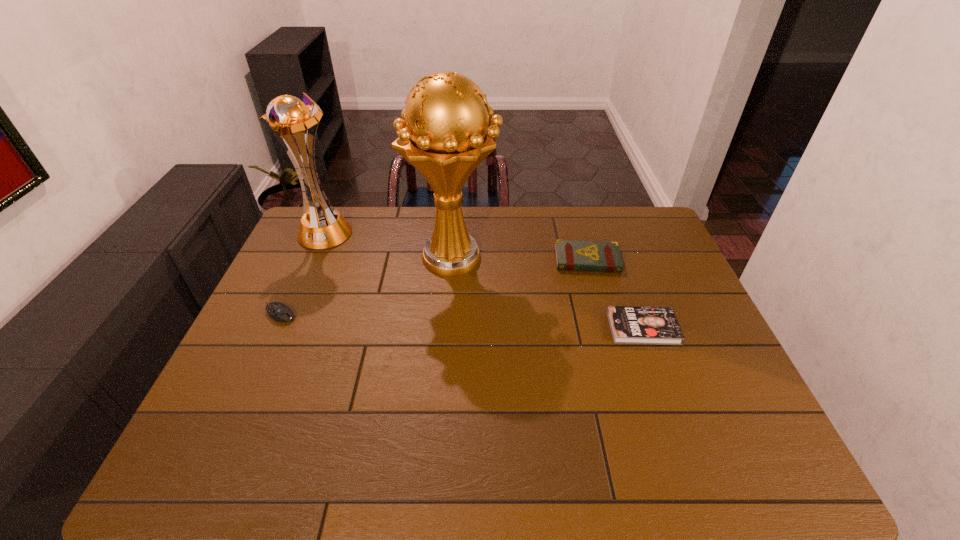
Where is `the tallest object`? This screenshot has width=960, height=540. the tallest object is located at coordinates (447, 136).

At what (x,y) coordinates should I click in order to perform the action: click on the taller trophy. Please return your answer as a coordinate pair (x, y). The image size is (960, 540). Looking at the image, I should click on (447, 136).

The height and width of the screenshot is (540, 960). I want to click on the left trophy, so click(x=287, y=117).

Locate an element on the screen. This screenshot has height=540, width=960. the fourth shortest object is located at coordinates (287, 117).

Where is `the farther book`? Image resolution: width=960 pixels, height=540 pixels. the farther book is located at coordinates (572, 255).

What are the coordinates of `computer mouse` in the screenshot? It's located at (279, 312).

Locate an element on the screen. the nearer book is located at coordinates [629, 324].

At what (x,y) coordinates should I click in order to perform the action: click on the shortest object. Please return your answer as a coordinate pair (x, y). The height and width of the screenshot is (540, 960). Looking at the image, I should click on (629, 324).

Locate an element on the screen. This screenshot has width=960, height=540. vacant region located 0.190m at the front of the taller trophy where the globe is prominent is located at coordinates (557, 256).

This screenshot has height=540, width=960. I want to click on vacant position located 0.220m on the front-facing side of the left trophy, so [x=297, y=296].